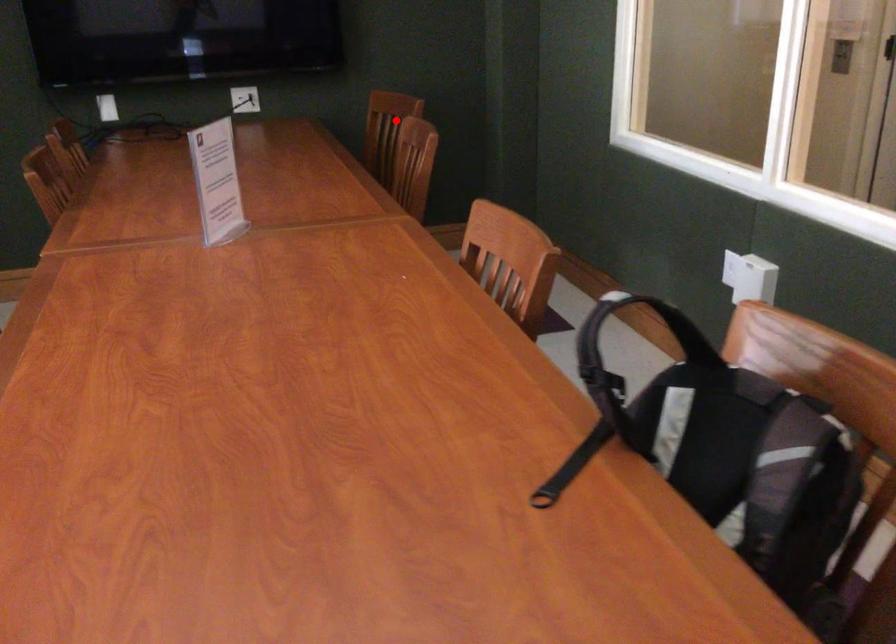
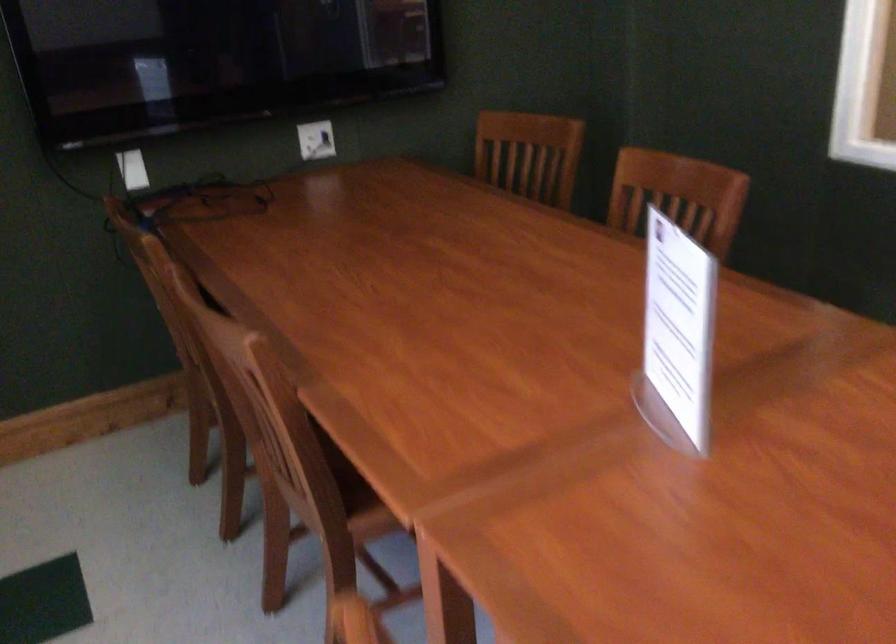
Question: A red point is marked in image1. In image2, is the corresponding 3D point closer to the camera or farther? Reply with the corresponding letter.

Choices:
 (A) The corresponding 3D point is closer.
 (B) The corresponding 3D point is farther.

Answer: (A)